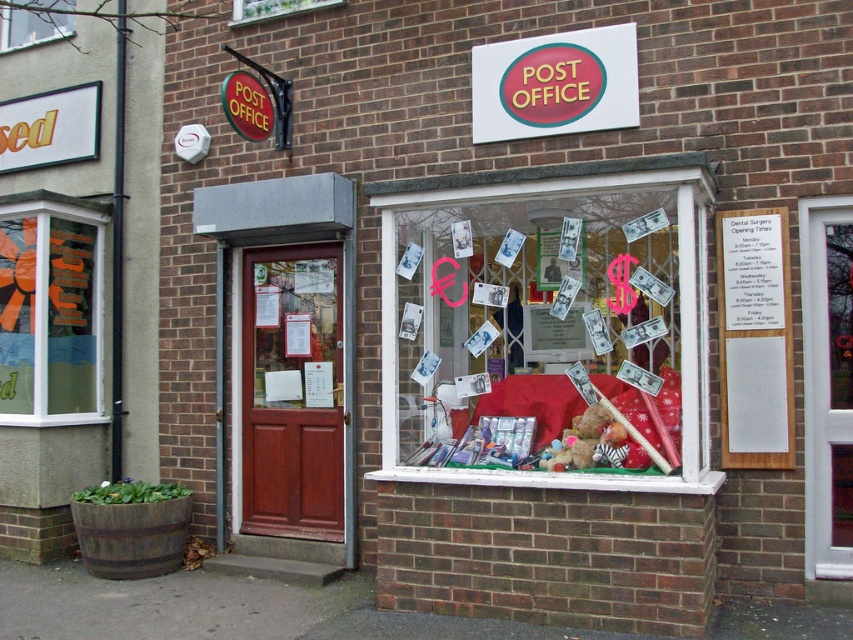
Based on the photo, you are a customer standing in front of the post office entrance. You need to check the displayed items in the transparent glass window at left and the transparent glass window at upper center. Which window is positioned higher from the ground?

The transparent glass window at upper center is positioned higher from the ground than the transparent glass window at left.

What is the position of the white plastic door at center relative to the clear glass window at upper center?

The white plastic door at center is located to the right of the clear glass window at upper center.

You are a delivery person with a box that is 1.2 meters long. You need to pass through the space between the translucent glass window at center and the matte plastic sign at upper center. Can your box fit through that space?

The distance between the translucent glass window at center and the matte plastic sign at upper center is 1.08 meters. Since the box is 1.2 meters long, it cannot fit through the space between them.